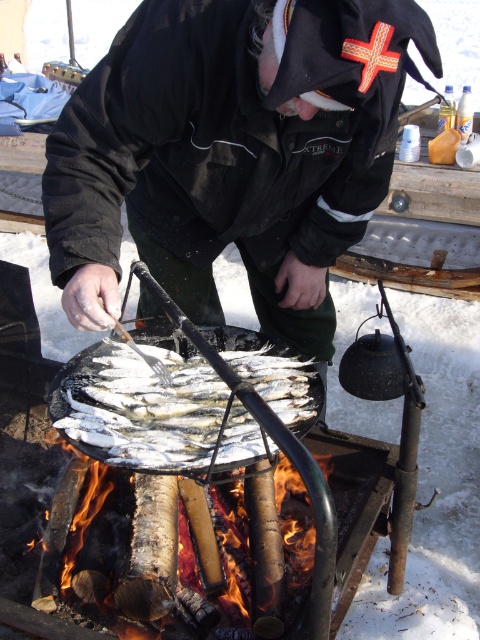
Question: Can you confirm if silver metallic fish at center is positioned above charcoal wood fire at lower left?

Choices:
 (A) no
 (B) yes

Answer: (B)

Question: Considering the relative positions of silver metallic fish at center and charcoal wood fire at lower left in the image provided, where is silver metallic fish at center located with respect to charcoal wood fire at lower left?

Choices:
 (A) above
 (B) below

Answer: (A)

Question: Which point is closer to the camera?

Choices:
 (A) silver metallic fish at center
 (B) charcoal wood fire at lower left

Answer: (B)

Question: Which object appears farthest from the camera in this image?

Choices:
 (A) charcoal wood fire at lower left
 (B) silver metallic fish at center

Answer: (B)

Question: Does silver metallic fish at center come behind charcoal wood fire at lower left?

Choices:
 (A) no
 (B) yes

Answer: (B)